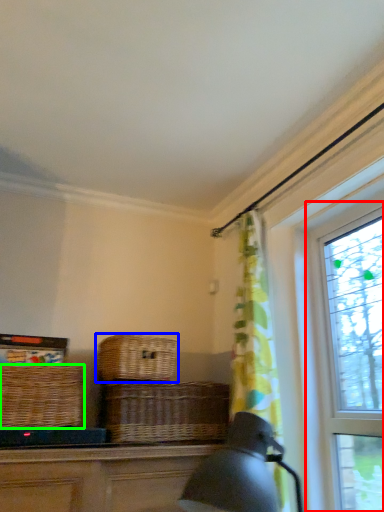
Question: Based on their relative distances, which object is nearer to window (highlighted by a red box)? Choose from picnic basket (highlighted by a blue box) and picnic basket (highlighted by a green box).

Choices:
 (A) picnic basket
 (B) picnic basket

Answer: (A)